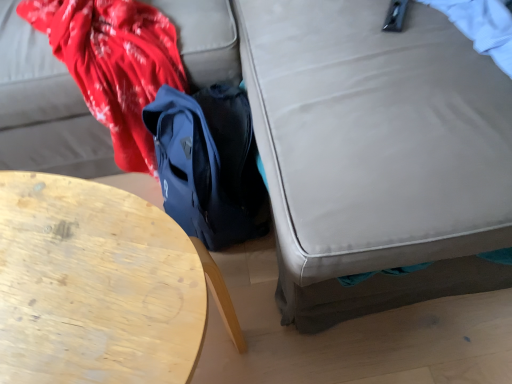
What do you see at coordinates (94, 285) in the screenshot? I see `wooden table at lower left` at bounding box center [94, 285].

I want to click on wooden table at lower left, so click(x=94, y=285).

Locate an element on the screen. This screenshot has height=384, width=512. wooden table at lower left is located at coordinates (94, 285).